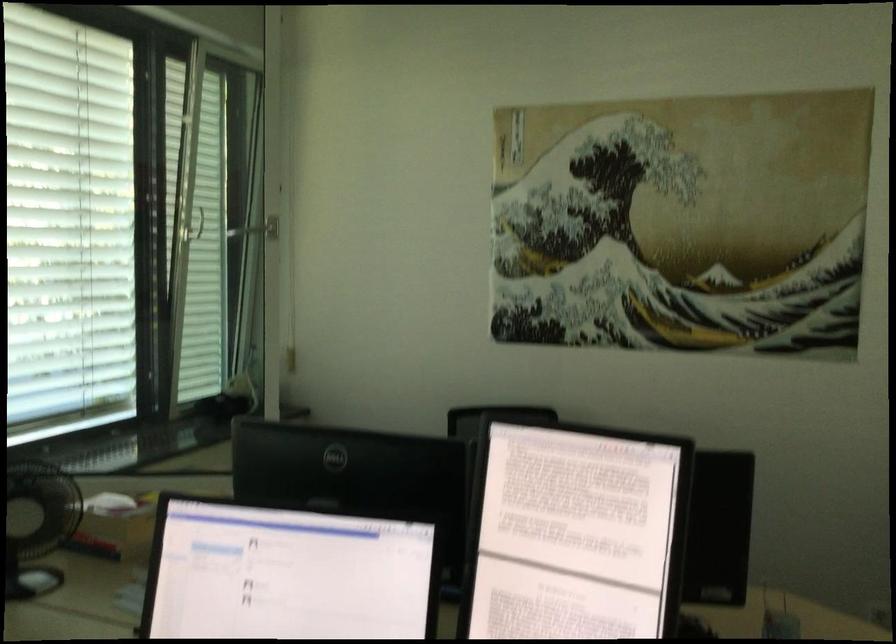
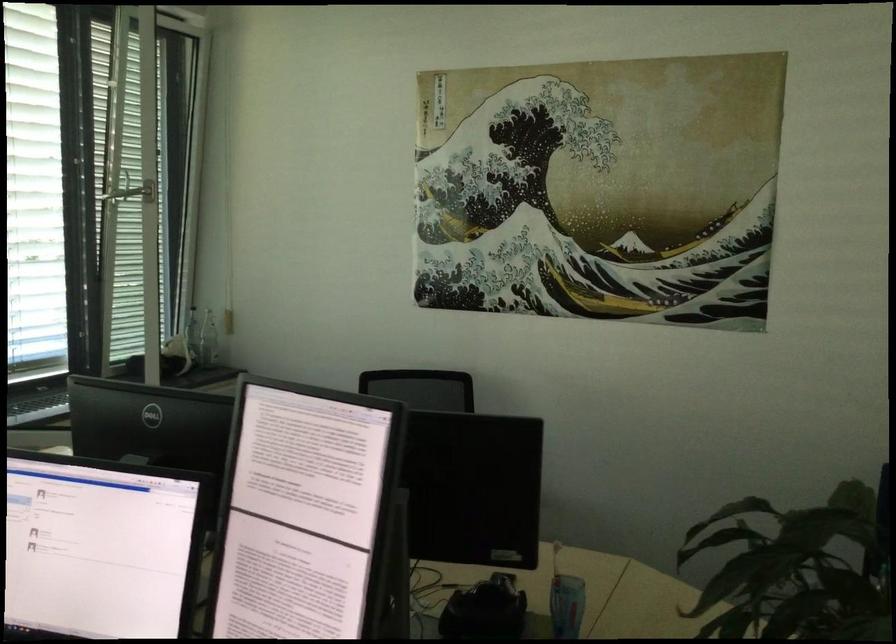
Question: What movement of the cameraman would produce the second image?

Choices:
 (A) Left
 (B) Right
 (C) Forward
 (D) Backward

Answer: (B)